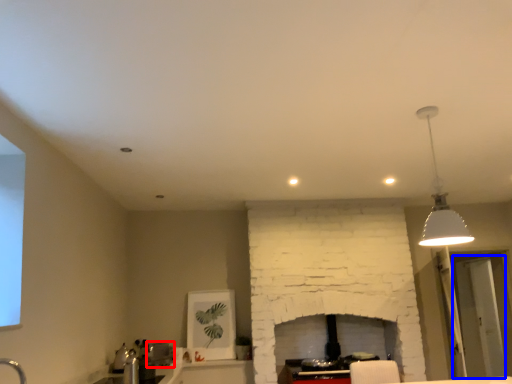
Question: Which object appears farthest to the camera in this image, appliance (highlighted by a red box) or glass door (highlighted by a blue box)?

Choices:
 (A) appliance
 (B) glass door

Answer: (B)